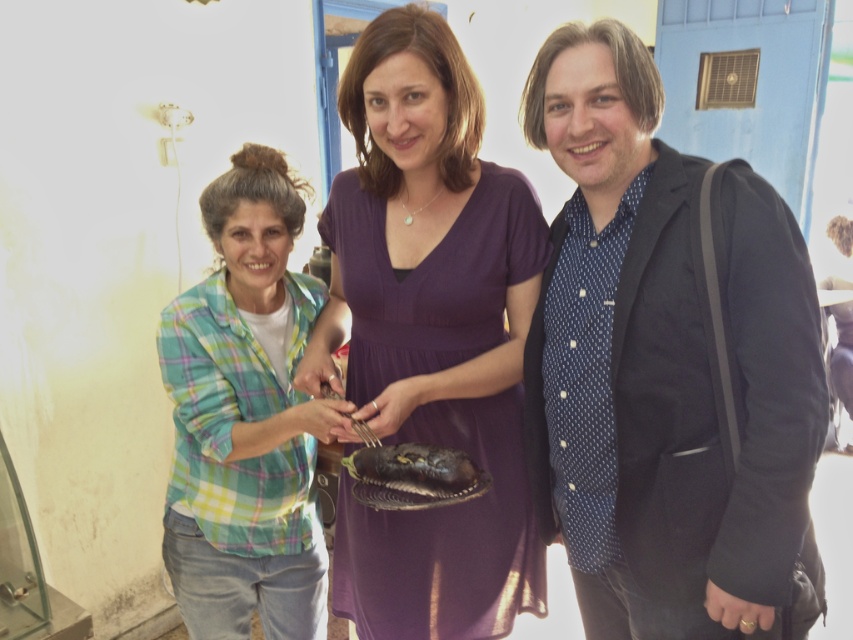
Question: Which point is farther to the camera?

Choices:
 (A) shiny silver plate at center
 (B) matte black blazer at center

Answer: (A)

Question: Is purple satin dress at center bigger than shiny silver plate at center?

Choices:
 (A) no
 (B) yes

Answer: (B)

Question: Is matte black blazer at center below purple satin dress at center?

Choices:
 (A) no
 (B) yes

Answer: (B)

Question: Which object is positioned closest to the purple satin dress at center?

Choices:
 (A) green plaid shirt at left
 (B) matte black blazer at center

Answer: (A)

Question: Which point appears closest to the camera in this image?

Choices:
 (A) (709, 372)
 (B) (456, 40)
 (C) (277, 173)
 (D) (421, 480)

Answer: (A)

Question: Does purple satin dress at center have a larger size compared to green plaid shirt at left?

Choices:
 (A) no
 (B) yes

Answer: (A)